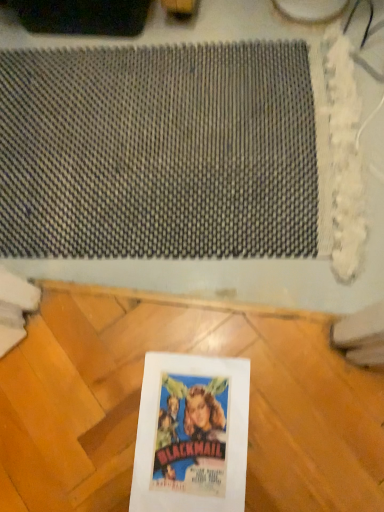
Question: Is textured gray mat at upper center smaller than white paper at center?

Choices:
 (A) no
 (B) yes

Answer: (A)

Question: Is white paper at center at the back of textured gray mat at upper center?

Choices:
 (A) yes
 (B) no

Answer: (B)

Question: Is textured gray mat at upper center outside white paper at center?

Choices:
 (A) no
 (B) yes

Answer: (B)

Question: From the image's perspective, is textured gray mat at upper center below white paper at center?

Choices:
 (A) no
 (B) yes

Answer: (A)

Question: Does textured gray mat at upper center have a lesser height compared to white paper at center?

Choices:
 (A) yes
 (B) no

Answer: (B)

Question: Does textured gray mat at upper center lie behind white paper at center?

Choices:
 (A) yes
 (B) no

Answer: (A)

Question: From the image's perspective, is white paper at center above textured gray mat at upper center?

Choices:
 (A) no
 (B) yes

Answer: (A)

Question: Can you confirm if white paper at center is bigger than textured gray mat at upper center?

Choices:
 (A) no
 (B) yes

Answer: (A)

Question: Would you consider white paper at center to be distant from textured gray mat at upper center?

Choices:
 (A) no
 (B) yes

Answer: (A)

Question: Does white paper at center have a greater width compared to textured gray mat at upper center?

Choices:
 (A) yes
 (B) no

Answer: (B)

Question: Considering the relative positions of white paper at center and textured gray mat at upper center in the image provided, is white paper at center in front of textured gray mat at upper center?

Choices:
 (A) no
 (B) yes

Answer: (B)

Question: Can you confirm if white paper at center is taller than textured gray mat at upper center?

Choices:
 (A) no
 (B) yes

Answer: (A)

Question: From their relative heights in the image, would you say white paper at center is taller or shorter than textured gray mat at upper center?

Choices:
 (A) short
 (B) tall

Answer: (A)